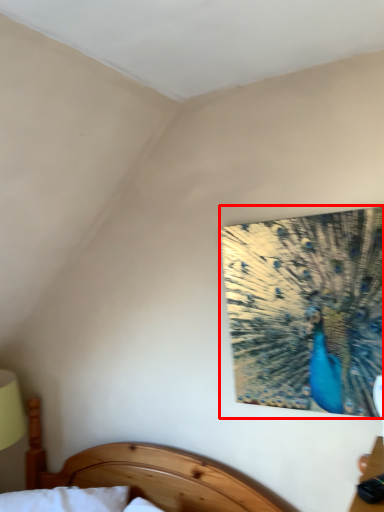
Question: From the image's perspective, where is peacock (annotated by the red box) located relative to bed?

Choices:
 (A) above
 (B) below

Answer: (A)